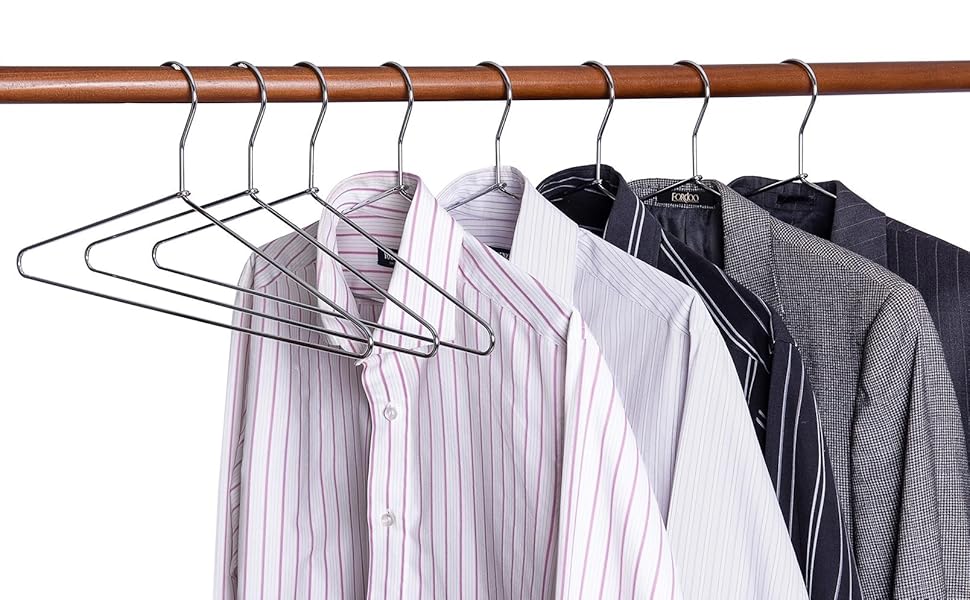
Locate an element on the screen. metal hanger hooks is located at coordinates (814, 81), (709, 85), (607, 90), (511, 94), (410, 98), (326, 95), (261, 100), (195, 102).